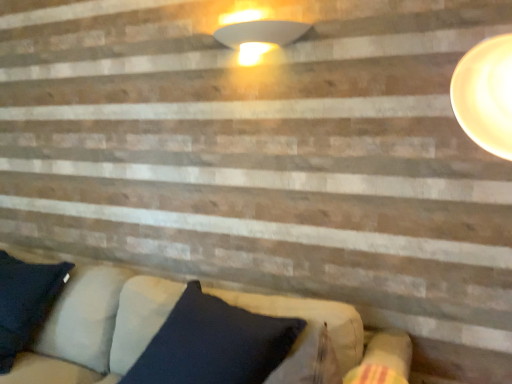
Describe the element at coordinates (201, 336) in the screenshot. The width and height of the screenshot is (512, 384). I see `velvet dark blue pillow at lower center` at that location.

This screenshot has width=512, height=384. What are the coordinates of `velvet dark blue pillow at lower center` in the screenshot? It's located at (201, 336).

You are a GUI agent. You are given a task and a screenshot of the screen. Output one action in this format:
    pyautogui.click(x=<x>, y=<y>)
    Task: Click on the white glossy lampshade at upper center
    Image resolution: width=512 pixels, height=384 pixels.
    Given the screenshot: What is the action you would take?
    pyautogui.click(x=259, y=37)

Measure the distance between white glossy lampshade at upper center and camera.

white glossy lampshade at upper center is 5.60 feet from camera.

What do you see at coordinates (259, 37) in the screenshot?
I see `white glossy lampshade at upper center` at bounding box center [259, 37].

You are a GUI agent. You are given a task and a screenshot of the screen. Output one action in this format:
    pyautogui.click(x=<x>, y=<y>)
    Task: Click on the velvet dark blue pillow at lower center
    This screenshot has width=512, height=384.
    Given the screenshot: What is the action you would take?
    pyautogui.click(x=201, y=336)

Which is more to the left, velvet dark blue pillow at lower center or white glossy lampshade at upper center?

white glossy lampshade at upper center is more to the left.

Relative to white glossy lampshade at upper center, is velvet dark blue pillow at lower center in front or behind?

Clearly, velvet dark blue pillow at lower center is in front of white glossy lampshade at upper center.

From the picture: Which point is more distant from viewer, [165,286] or [300,31]?

Point [165,286]

From the image's perspective, which object appears higher, velvet dark blue pillow at lower center or white glossy lampshade at upper center?

white glossy lampshade at upper center appears higher in the image.

From a real-world perspective, is velvet dark blue pillow at lower center physically located above or below white glossy lampshade at upper center?

From a real-world perspective, velvet dark blue pillow at lower center is physically below white glossy lampshade at upper center.

Considering the relative sizes of velvet dark blue pillow at lower center and white glossy lampshade at upper center in the image provided, is velvet dark blue pillow at lower center wider than white glossy lampshade at upper center?

Correct, the width of velvet dark blue pillow at lower center exceeds that of white glossy lampshade at upper center.

Which of these two, velvet dark blue pillow at lower center or white glossy lampshade at upper center, stands taller?

With more height is velvet dark blue pillow at lower center.

Considering the sizes of objects velvet dark blue pillow at lower center and white glossy lampshade at upper center in the image provided, who is bigger, velvet dark blue pillow at lower center or white glossy lampshade at upper center?

velvet dark blue pillow at lower center.

Could white glossy lampshade at upper center be considered to be inside velvet dark blue pillow at lower center?

No.

Is the surface of velvet dark blue pillow at lower center in direct contact with white glossy lampshade at upper center?

They are not placed beside each other.

Could you tell me if velvet dark blue pillow at lower center is facing white glossy lampshade at upper center?

No, velvet dark blue pillow at lower center is not turned towards white glossy lampshade at upper center.

Where is `studio couch that appears below the white glossy lampshade at upper center (from the image's perspective)`? This screenshot has height=384, width=512. studio couch that appears below the white glossy lampshade at upper center (from the image's perspective) is located at coordinates (201, 336).

Would you say white glossy lampshade at upper center is to the left or to the right of velvet dark blue pillow at lower center in the picture?

Based on their positions, white glossy lampshade at upper center is located to the left of velvet dark blue pillow at lower center.

Considering the positions of objects white glossy lampshade at upper center and velvet dark blue pillow at lower center in the image provided, who is behind, white glossy lampshade at upper center or velvet dark blue pillow at lower center?

white glossy lampshade at upper center is behind.

Between point (261, 34) and point (223, 336), which one is positioned behind?

Point (261, 34)

From the image's perspective, would you say white glossy lampshade at upper center is shown under velvet dark blue pillow at lower center?

Actually, white glossy lampshade at upper center appears above velvet dark blue pillow at lower center in the image.

From a real-world perspective, is white glossy lampshade at upper center above or below velvet dark blue pillow at lower center?

Clearly, from a real-world perspective, white glossy lampshade at upper center is above velvet dark blue pillow at lower center.

Which object is wider, white glossy lampshade at upper center or velvet dark blue pillow at lower center?

velvet dark blue pillow at lower center is wider.

In terms of height, does white glossy lampshade at upper center look taller or shorter compared to velvet dark blue pillow at lower center?

Clearly, white glossy lampshade at upper center is shorter compared to velvet dark blue pillow at lower center.

Which of these two, white glossy lampshade at upper center or velvet dark blue pillow at lower center, is smaller?

Smaller between the two is white glossy lampshade at upper center.

Based on the photo, is velvet dark blue pillow at lower center completely or partially inside white glossy lampshade at upper center?

Actually, velvet dark blue pillow at lower center is outside white glossy lampshade at upper center.

Is there a large distance between white glossy lampshade at upper center and velvet dark blue pillow at lower center?

Yes, white glossy lampshade at upper center and velvet dark blue pillow at lower center are located far from each other.

Is white glossy lampshade at upper center facing towards velvet dark blue pillow at lower center?

No.

Locate an element on the screen. The width and height of the screenshot is (512, 384). studio couch that is in front of the white glossy lampshade at upper center is located at coordinates (201, 336).

I want to click on studio couch beneath the white glossy lampshade at upper center (from a real-world perspective), so click(x=201, y=336).

Image resolution: width=512 pixels, height=384 pixels. I want to click on studio couch on the right of white glossy lampshade at upper center, so click(201, 336).